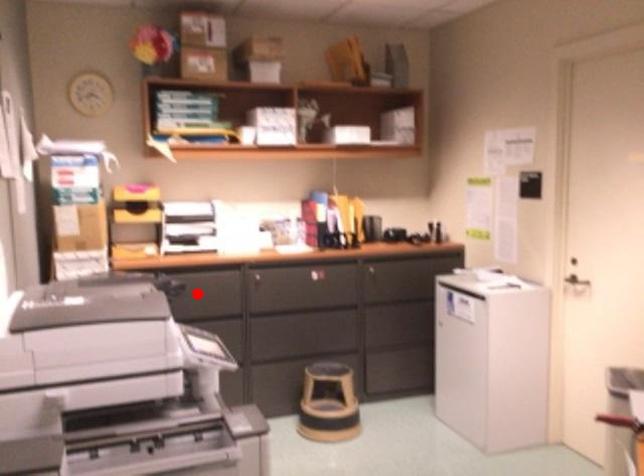
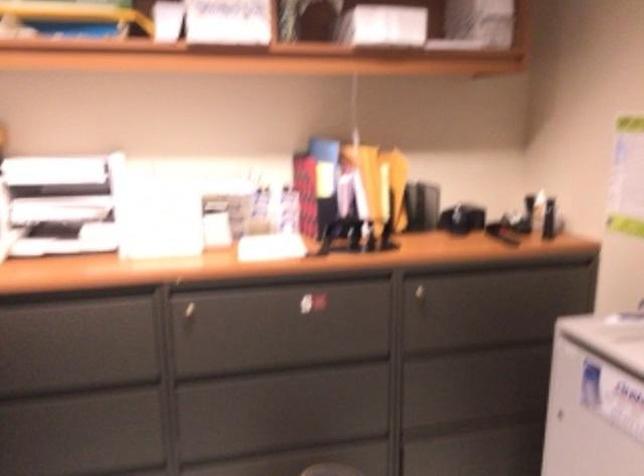
The point at the highlighted location is marked in the first image. Where is the corresponding point in the second image?

(70, 336)